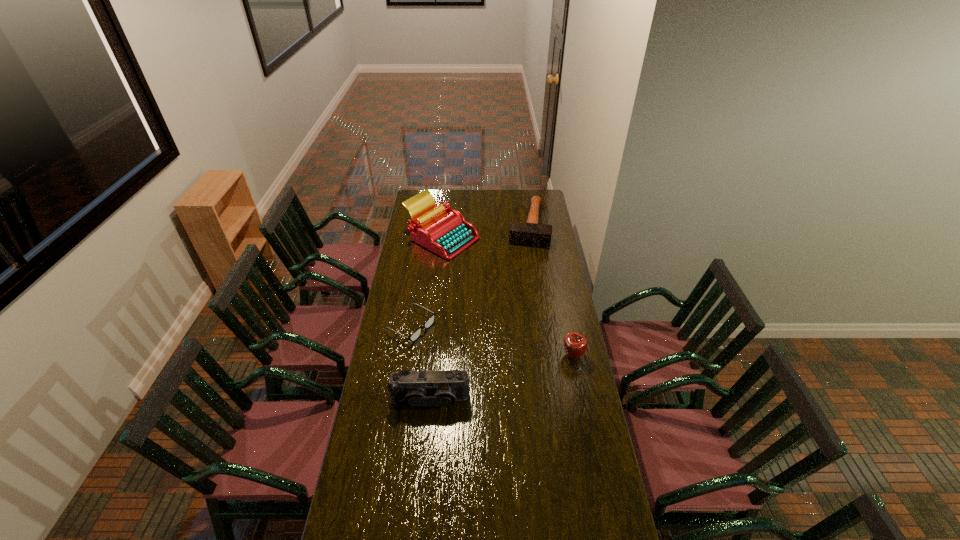
Where is `the nearest object`? The image size is (960, 540). the nearest object is located at coordinates (443, 388).

Find the location of a particular element. This screenshot has height=540, width=960. the third tallest object is located at coordinates (575, 344).

This screenshot has height=540, width=960. I want to click on the fourth farthest object, so click(575, 344).

Find the location of a particular element. The height and width of the screenshot is (540, 960). mallet is located at coordinates (530, 233).

Locate an element on the screen. This screenshot has height=540, width=960. spectacles is located at coordinates (414, 336).

The image size is (960, 540). I want to click on the shortest object, so click(x=414, y=336).

I want to click on typewriter, so click(x=444, y=231).

You are a GUI agent. You are given a task and a screenshot of the screen. Output one action in this format:
    pyautogui.click(x=<x>, y=<y>)
    Task: Click on the vacant space situated on the front-facing side of the nearest object
    The height and width of the screenshot is (540, 960).
    Given the screenshot: What is the action you would take?
    pyautogui.click(x=425, y=442)

Identify the location of vacant space located 0.050m on the back of the third shortest object. The width and height of the screenshot is (960, 540). 569,339.

You are a GUI agent. You are given a task and a screenshot of the screen. Output one action in this format:
    pyautogui.click(x=<x>, y=<y>)
    Task: Click on the vacant space located 0.290m on the striking face of the fourth tallest object
    The width and height of the screenshot is (960, 540).
    Given the screenshot: What is the action you would take?
    pyautogui.click(x=521, y=281)